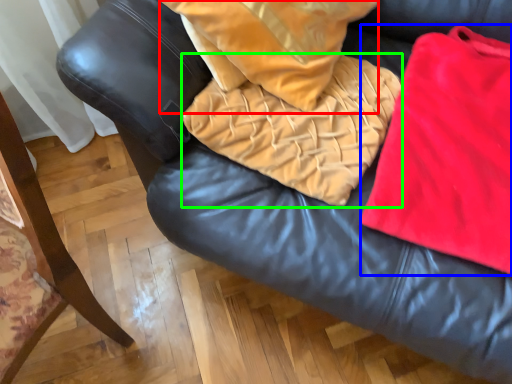
Question: Based on their relative distances, which object is farther from throw pillow (highlighted by a red box)? Choose from cloth (highlighted by a blue box) and blanket (highlighted by a green box).

Choices:
 (A) cloth
 (B) blanket

Answer: (A)